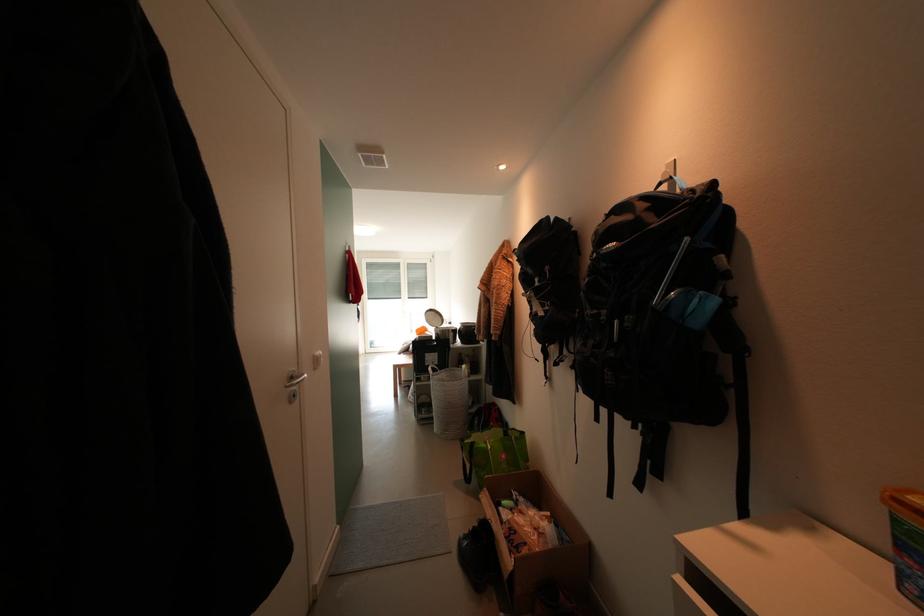
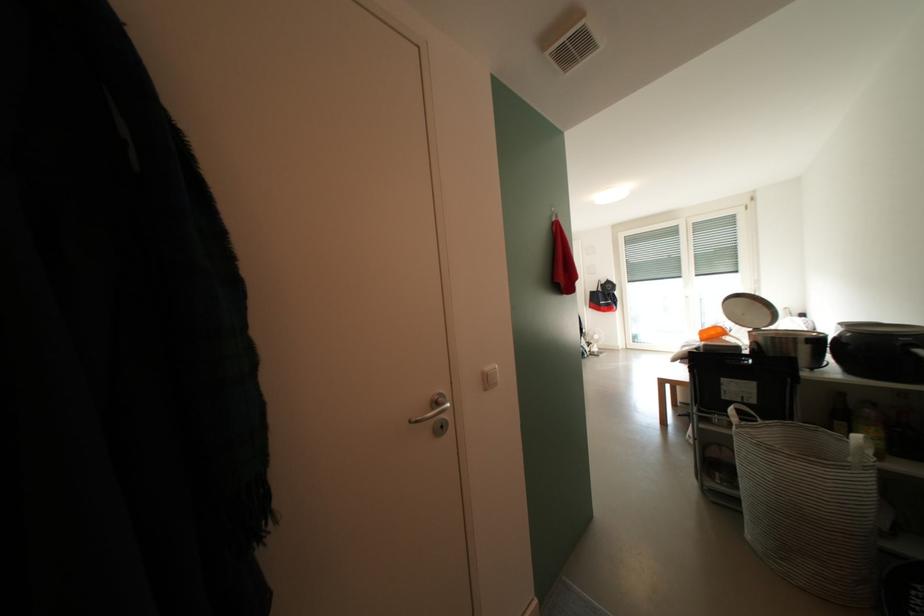
Question: The images are taken continuously from a first-person perspective. In which direction is your viewpoint rotating?

Choices:
 (A) Left
 (B) Right
 (C) Up
 (D) Down

Answer: (A)